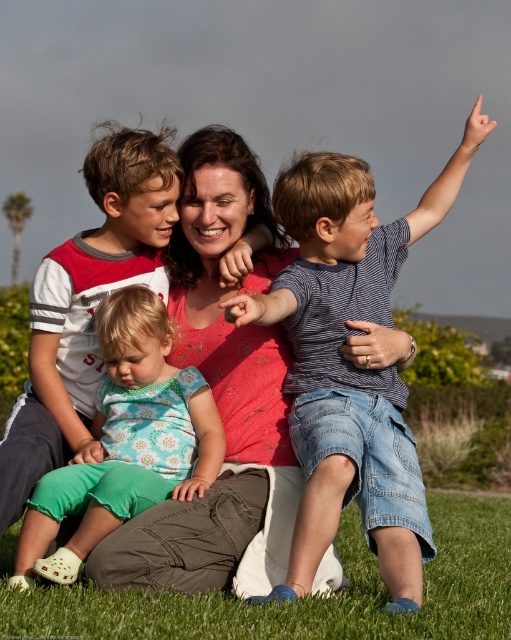
Question: Which point is closer to the camera taking this photo?

Choices:
 (A) (455, 179)
 (B) (136, 138)
 (C) (227, 634)

Answer: (C)

Question: Observing the image, what is the correct spatial positioning of striped cotton shirt at right in reference to floral fabric dress at lower left?

Choices:
 (A) right
 (B) left

Answer: (A)

Question: Among these objects, which one is nearest to the camera?

Choices:
 (A) green grass at lower center
 (B) floral fabric dress at lower left

Answer: (A)

Question: Can you confirm if white striped shirt at left is thinner than floral fabric dress at lower left?

Choices:
 (A) no
 (B) yes

Answer: (B)

Question: Among these objects, which one is farthest from the camera?

Choices:
 (A) white striped shirt at left
 (B) floral fabric dress at lower left

Answer: (A)

Question: Does striped cotton shirt at right have a smaller size compared to green grass at lower center?

Choices:
 (A) yes
 (B) no

Answer: (A)